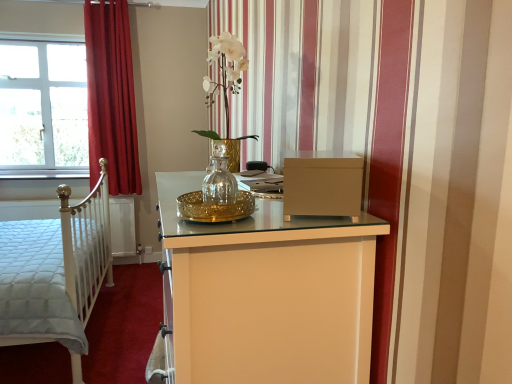
Question: From their relative heights in the image, would you say matte brown file cabinet at center is taller or shorter than red velvet curtain at left?

Choices:
 (A) tall
 (B) short

Answer: (B)

Question: Would you say matte brown file cabinet at center is to the left or to the right of red velvet curtain at left in the picture?

Choices:
 (A) left
 (B) right

Answer: (B)

Question: Which object is the closest to the white glass window at upper left?

Choices:
 (A) matte brown file cabinet at center
 (B) clear glass vase at center
 (C) white quilted fabric bed at left
 (D) red velvet curtain at left

Answer: (D)

Question: Which of these objects is positioned closest to the clear glass vase at center?

Choices:
 (A) red velvet curtain at left
 (B) white glass window at upper left
 (C) white quilted fabric bed at left
 (D) matte brown file cabinet at center

Answer: (D)